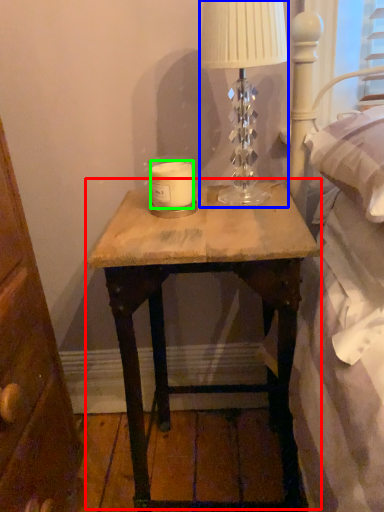
Question: Based on their relative distances, which object is farther from nightstand (highlighted by a red box)? Choose from table lamp (highlighted by a blue box) and candle (highlighted by a green box).

Choices:
 (A) table lamp
 (B) candle

Answer: (B)